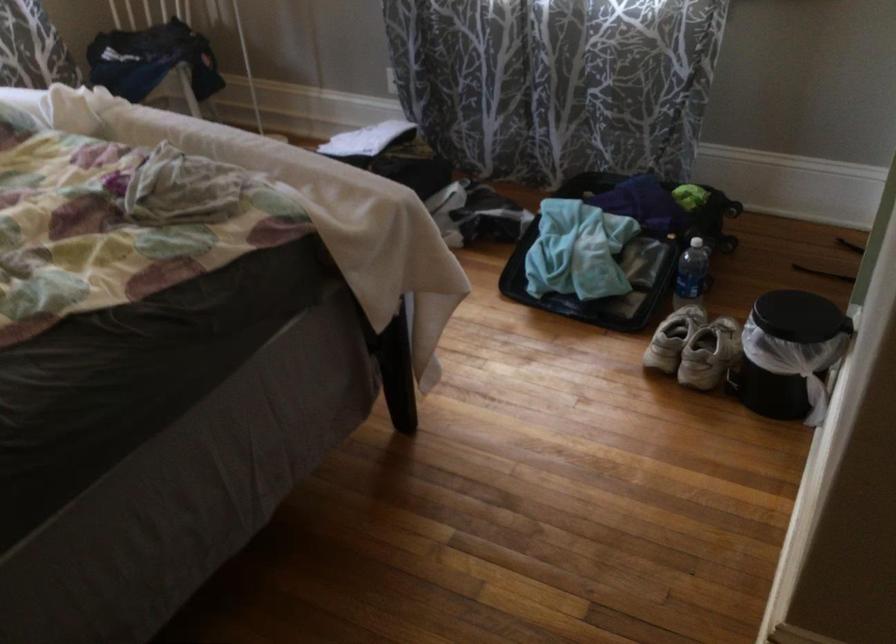
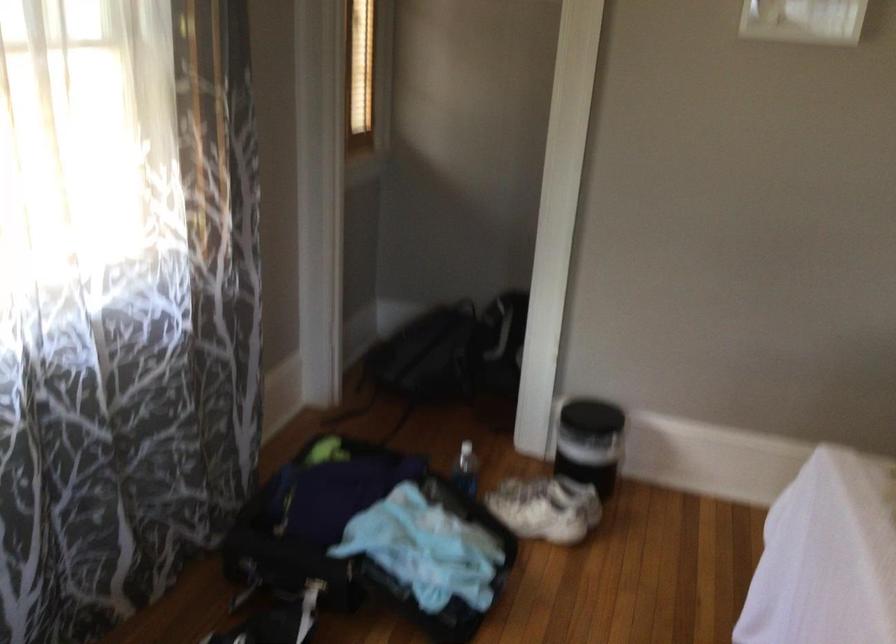
In the second image, find the point that corresponds to (x=670, y=328) in the first image.

(546, 507)